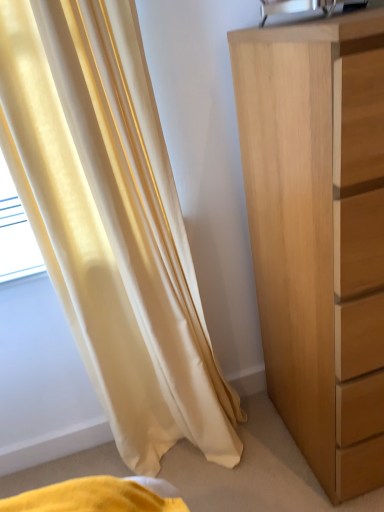
Identify the location of vacant space underneath satin yellow curtain at left (from a real-world perspective). This screenshot has width=384, height=512. (182, 459).